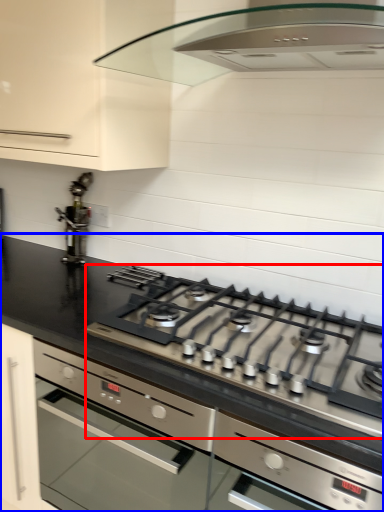
Question: Among these objects, which one is nearest to the camera, gas stove (highlighted by a red box) or countertop (highlighted by a blue box)?

Choices:
 (A) gas stove
 (B) countertop

Answer: (A)